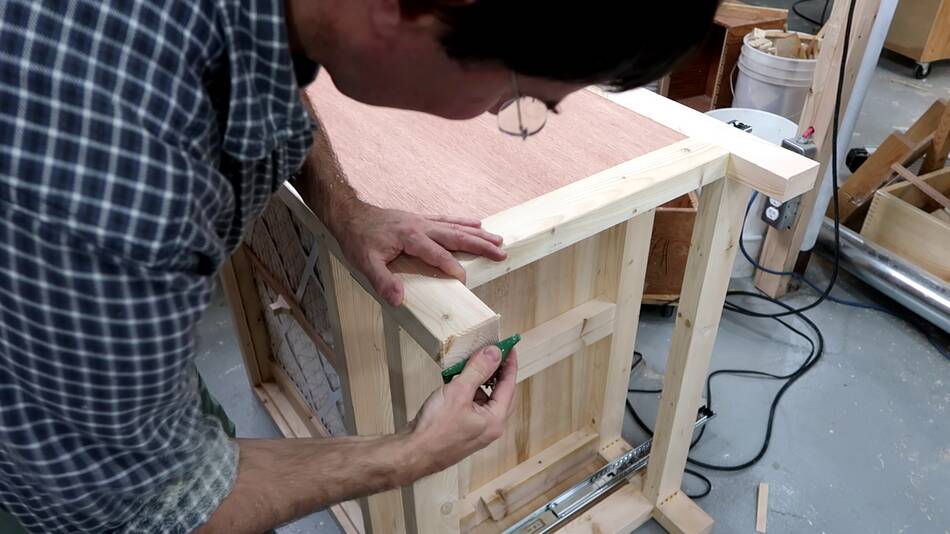
This screenshot has height=534, width=950. In order to click on wood cabinet in this screenshot , I will do `click(561, 297)`.